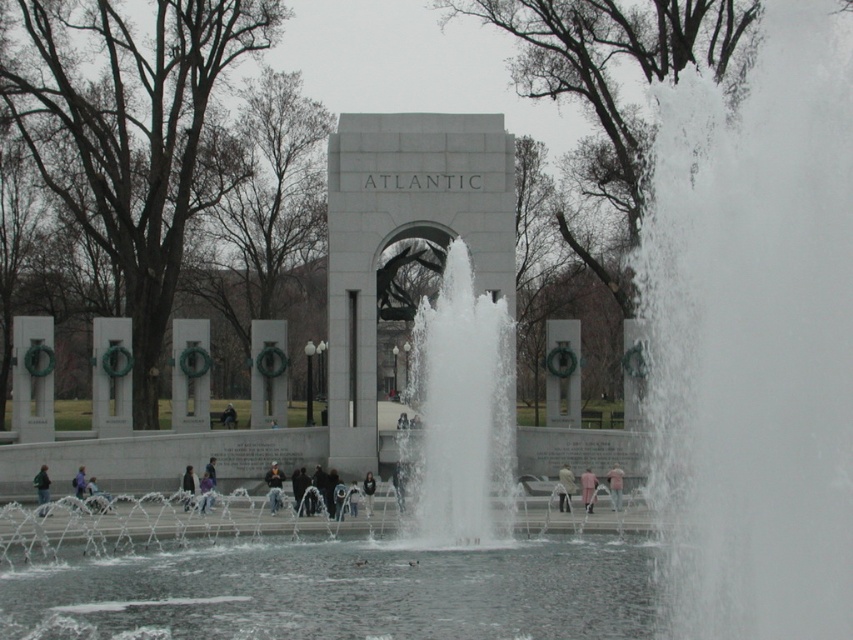
You are standing in the park near the monument and want to take a photo of both the dark blue jeans at lower left and the dark gray jacket at center. Which object should you zoom in on to ensure both are in the frame?

You should zoom in on the dark gray jacket at center because it is smaller than the dark blue jeans at lower left, allowing both to fit within the camera frame more easily.

You are standing in front of the monument and see a light brown leather jacket at center and dark blue jeans at lower left. Which item is positioned to the right of the other?

The light brown leather jacket at center is to the right of dark blue jeans at lower left.